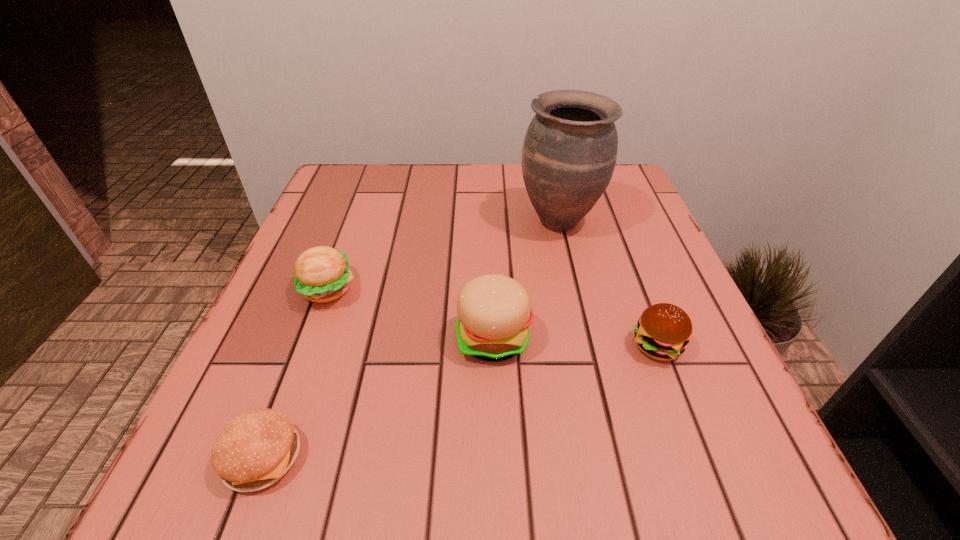
Select which object is the closest to the nearest object. Please provide its 2D coordinates. Your answer should be formatted as a tuple, i.e. [(x, y)], where the tuple contains the x and y coordinates of a point satisfying the conditions above.

[(321, 273)]

Choose which hamburger is the nearest neighbor to the third object from right to left. Please provide its 2D coordinates. Your answer should be formatted as a tuple, i.e. [(x, y)], where the tuple contains the x and y coordinates of a point satisfying the conditions above.

[(663, 331)]

Identify the location of the closest hamburger to the shortest hamburger. This screenshot has height=540, width=960. (321, 273).

Where is `blank space that satisfies the following two spatial constraints: 1. on the back side of the rightmost hamburger; 2. on the left side of the nearest object`? Image resolution: width=960 pixels, height=540 pixels. blank space that satisfies the following two spatial constraints: 1. on the back side of the rightmost hamburger; 2. on the left side of the nearest object is located at coordinates (304, 346).